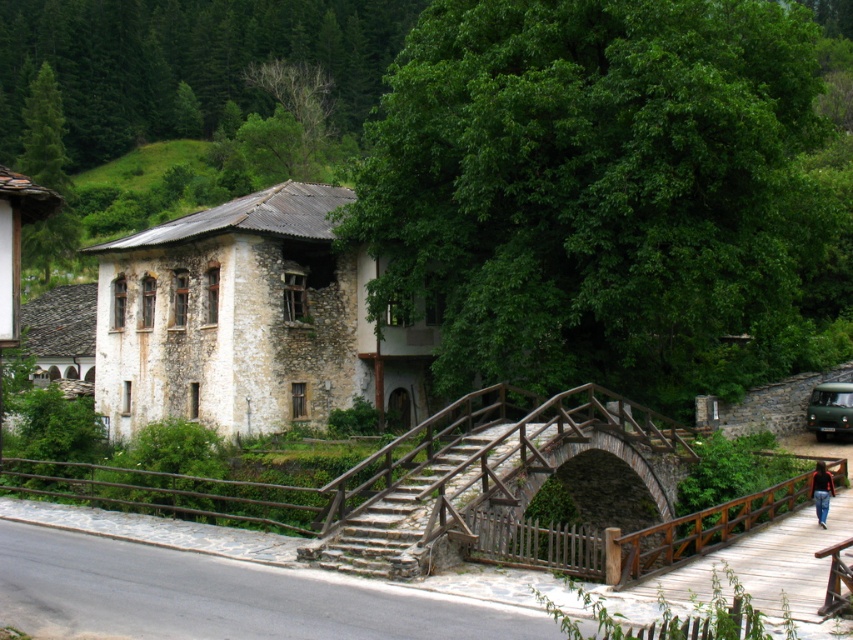
You are a hiker who wants to cross the wooden bridge at center. You have a GPS device that shows your current position is 15 meters away from the bridge. Is the GPS reading accurate?

The wooden bridge at center is 16.16 meters away from the camera, so the GPS reading showing 15 meters is not accurate. The actual distance is approximately 1.16 meters more than what the GPS indicates.